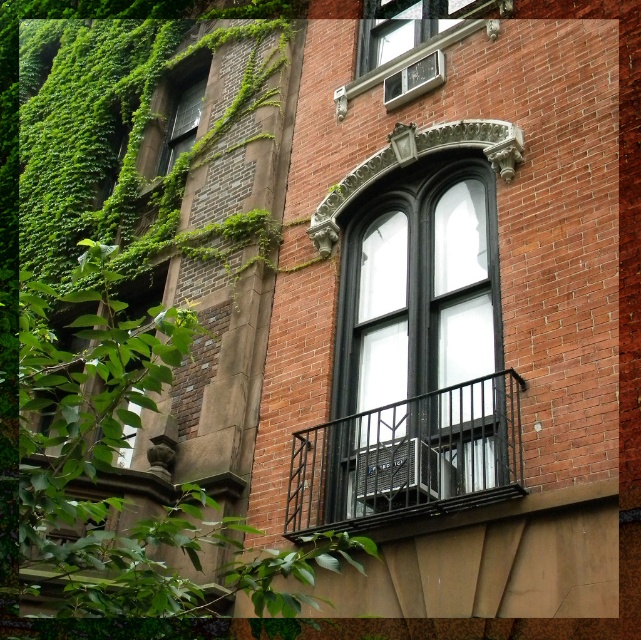
You are an architect designing a new building inspired by this style. You need to ensure that the black glass window at center and the green mossy wall at upper left are proportionally scaled. Which object should be made larger to maintain the traditional aesthetic seen here?

The black glass window at center should be made larger than the green mossy wall at upper left to maintain the traditional aesthetic seen here, as it is already larger in the original design.

You are an architect analyzing the building facade. You notice the white glass window at upper center and the green mossy wall at upper left. Which one has a smaller height?

The white glass window at upper center has a lesser height compared to the green mossy wall at upper left, so the white glass window at upper center is smaller in height.

You are standing in front of a historic building and notice a specific point marked at coordinates point (462,10). If your camera has a focal length of 50 mm, can you estimate whether this point is closer than 50 meters to you?

The distance of point (462,10) from viewer is 48.50 meters, which is less than 50 meters. Therefore, the point is closer than 50 meters to you.